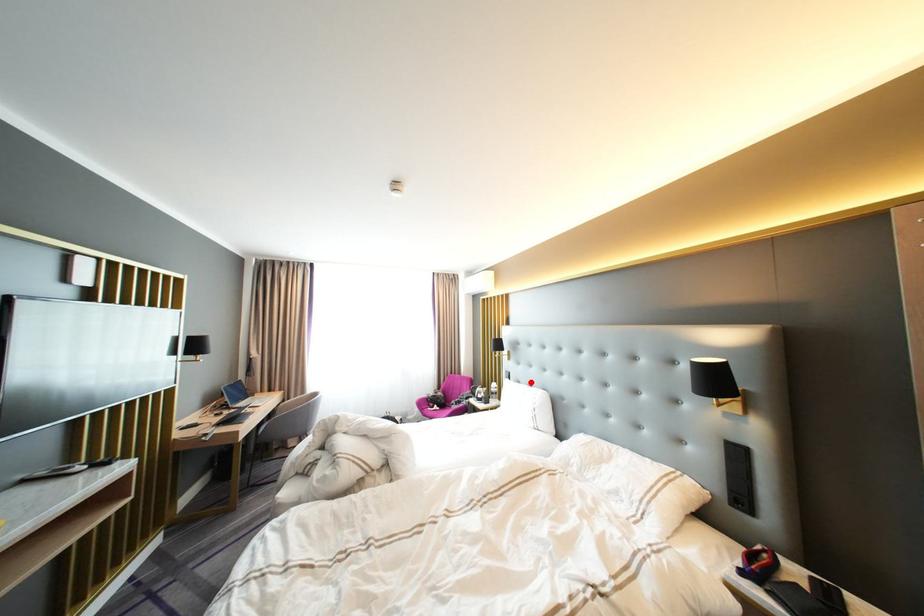
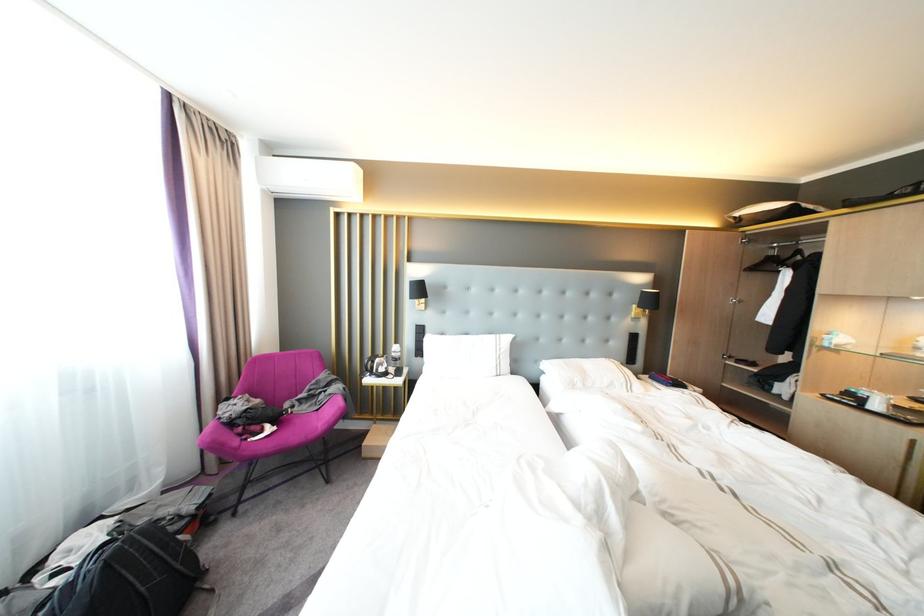
In the second image, find the point that corresponds to the highlighted location in the first image.

(455, 334)